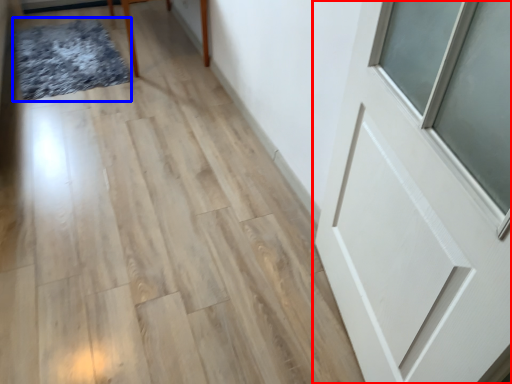
Question: Which object is further to the camera taking this photo, door (highlighted by a red box) or mat (highlighted by a blue box)?

Choices:
 (A) door
 (B) mat

Answer: (B)